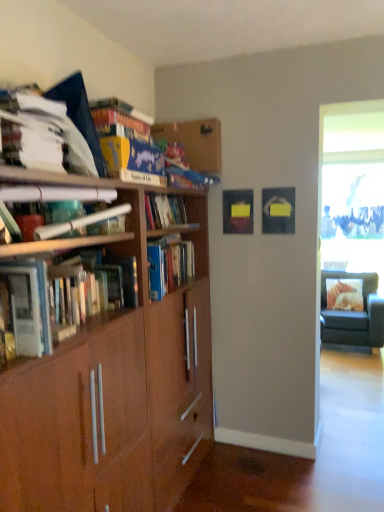
Question: Is matte brown paper at upper left, the 3th book in the top-to-bottom sequence, smaller than wooden bookshelf at upper center?

Choices:
 (A) no
 (B) yes

Answer: (A)

Question: From a real-world perspective, is matte brown paper at upper left, the second book from the bottom, on top of wooden bookshelf at upper center?

Choices:
 (A) yes
 (B) no

Answer: (B)

Question: Does matte brown paper at upper left, the second book from the bottom, touch wooden bookshelf at upper center?

Choices:
 (A) yes
 (B) no

Answer: (B)

Question: Can you confirm if matte brown paper at upper left, the 3th book in the top-to-bottom sequence, is thinner than wooden bookshelf at upper center?

Choices:
 (A) yes
 (B) no

Answer: (A)

Question: Is matte brown paper at upper left, the second book from the bottom, wider than wooden bookshelf at upper center?

Choices:
 (A) yes
 (B) no

Answer: (B)

Question: Is matte brown paper at upper left, the 3th book in the top-to-bottom sequence, taller than wooden bookshelf at upper center?

Choices:
 (A) no
 (B) yes

Answer: (A)

Question: Are white paper at upper left, which is counted as the 2th book, starting from the top, and matte brown paper at upper left, the second book from the bottom, beside each other?

Choices:
 (A) no
 (B) yes

Answer: (A)

Question: Considering the relative positions of white paper at upper left, which ranks as the third book in bottom-to-top order, and matte brown paper at upper left, the second book from the bottom, in the image provided, is white paper at upper left, which ranks as the third book in bottom-to-top order, to the right of matte brown paper at upper left, the second book from the bottom, from the viewer's perspective?

Choices:
 (A) yes
 (B) no

Answer: (B)

Question: Is white paper at upper left, which is counted as the 2th book, starting from the top, closer to the viewer compared to matte brown paper at upper left, the second book from the bottom?

Choices:
 (A) yes
 (B) no

Answer: (B)

Question: Is white paper at upper left, which ranks as the third book in bottom-to-top order, facing away from matte brown paper at upper left, the 3th book in the top-to-bottom sequence?

Choices:
 (A) no
 (B) yes

Answer: (A)

Question: Considering the relative sizes of white paper at upper left, which is counted as the 2th book, starting from the top, and matte brown paper at upper left, the second book from the bottom, in the image provided, is white paper at upper left, which is counted as the 2th book, starting from the top, bigger than matte brown paper at upper left, the second book from the bottom,?

Choices:
 (A) yes
 (B) no

Answer: (B)

Question: Does white paper at upper left, which is counted as the 2th book, starting from the top, appear on the left side of matte brown paper at upper left, the second book from the bottom?

Choices:
 (A) yes
 (B) no

Answer: (A)

Question: Is hardcover books at left, which appears as the 1th book when ordered from the bottom, positioned far away from brown wood bookcase at left?

Choices:
 (A) yes
 (B) no

Answer: (B)